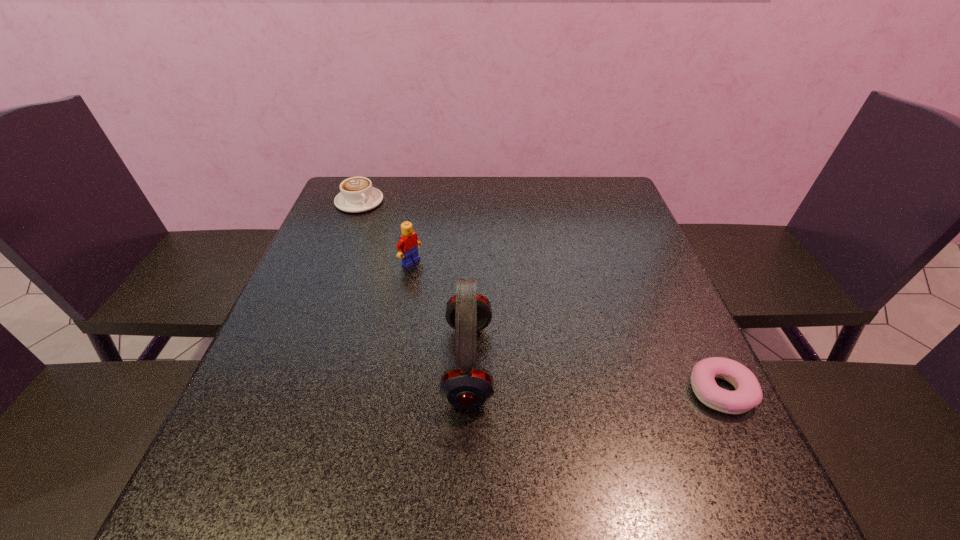
This screenshot has height=540, width=960. I want to click on unoccupied position between the pastry and the earphone, so click(x=594, y=377).

Locate an element on the screen. The width and height of the screenshot is (960, 540). vacant point located between the second farthest object and the third object from left to right is located at coordinates (440, 313).

Identify the location of vacant area that lies between the Lego and the rightmost object. (566, 327).

This screenshot has height=540, width=960. Identify the location of free space that is in between the leftmost object and the second object from left to right. (385, 232).

You are a GUI agent. You are given a task and a screenshot of the screen. Output one action in this format:
    pyautogui.click(x=<x>, y=<y>)
    Task: Click on the vacant space that's between the tallest object and the second tallest object
    The height and width of the screenshot is (540, 960).
    Given the screenshot: What is the action you would take?
    pyautogui.click(x=440, y=313)

Identify the location of empty space between the farthest object and the second object from right to left. (x=414, y=282).

Find the location of a particular element. The image size is (960, 540). vacant space in between the earphone and the third object from right to left is located at coordinates (440, 313).

This screenshot has height=540, width=960. I want to click on free space between the third object from left to right and the second object from left to right, so click(440, 313).

Find the location of `free space between the tallest object and the pastry`. free space between the tallest object and the pastry is located at coordinates (594, 377).

Identify the location of blank region between the rightmost object and the tallest object. This screenshot has height=540, width=960. (594, 377).